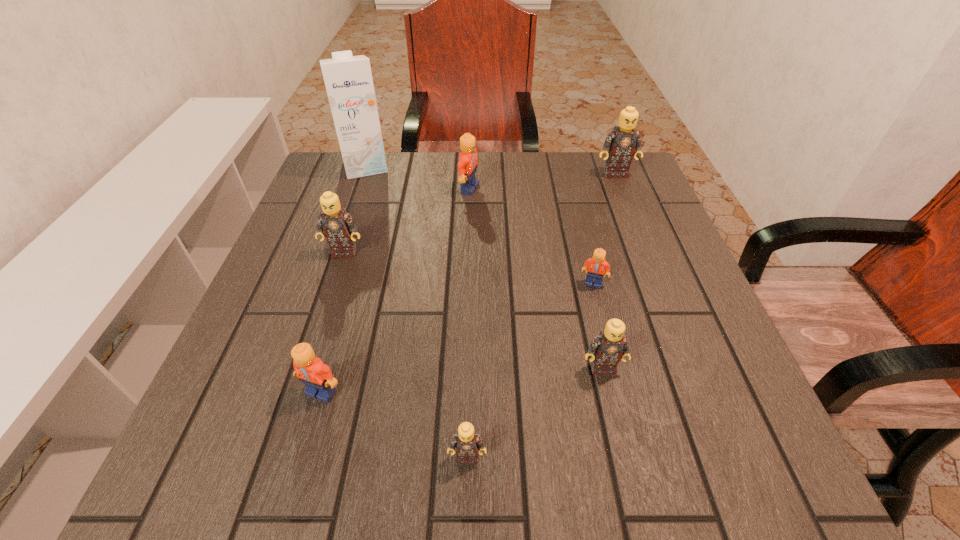
Where is `blank region between the fourth farthest Lego and the rightmost tan Lego`? blank region between the fourth farthest Lego and the rightmost tan Lego is located at coordinates (604, 229).

Locate an element on the screen. This screenshot has width=960, height=540. free spot between the fifth nearest Lego and the second tan Lego from right to left is located at coordinates (473, 310).

Where is `vacant region between the nearest object and the third farthest tan Lego`? The image size is (960, 540). vacant region between the nearest object and the third farthest tan Lego is located at coordinates (535, 412).

Locate an element on the screen. free space between the tallest object and the seventh shortest object is located at coordinates (491, 170).

Find the location of a particular element. object that is the closest to the second farthest tan Lego is located at coordinates click(x=467, y=166).

Where is `the fourth closest object to the rightmost Lego`? the fourth closest object to the rightmost Lego is located at coordinates (607, 349).

This screenshot has width=960, height=540. I want to click on Lego that is the fourth closest to the tallest object, so click(x=596, y=265).

At what (x,y) coordinates should I click in order to perform the action: click on Lego that is the sixth closest to the rightmost tan Lego. Please return your answer as a coordinate pair (x, y). Looking at the image, I should click on (317, 377).

Locate an element on the screen. tan Lego identified as the second closest to the farthest Lego is located at coordinates (338, 226).

Identify which tan Lego is located as the third nearest to the fourth nearest object. Please provide its 2D coordinates. Your answer should be formatted as a tuple, i.e. [(x, y)], where the tuple contains the x and y coordinates of a point satisfying the conditions above.

[(467, 442)]